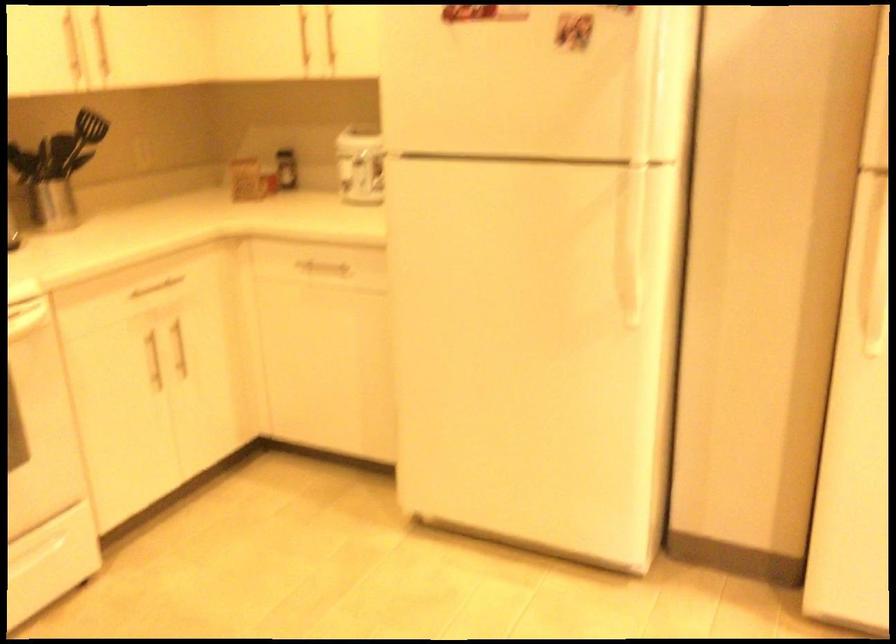
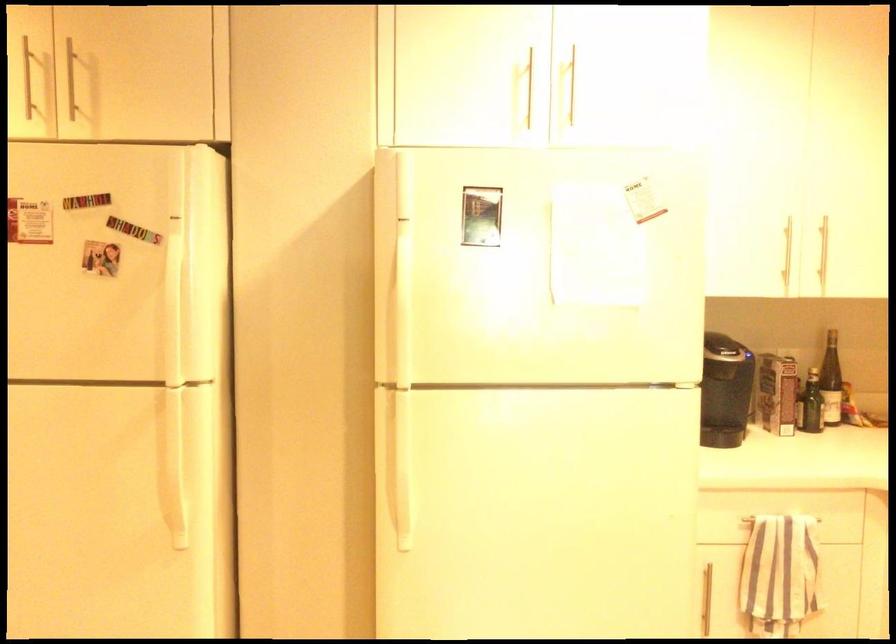
In the second image, find the point that corresponds to point (629, 234) in the first image.

(170, 453)